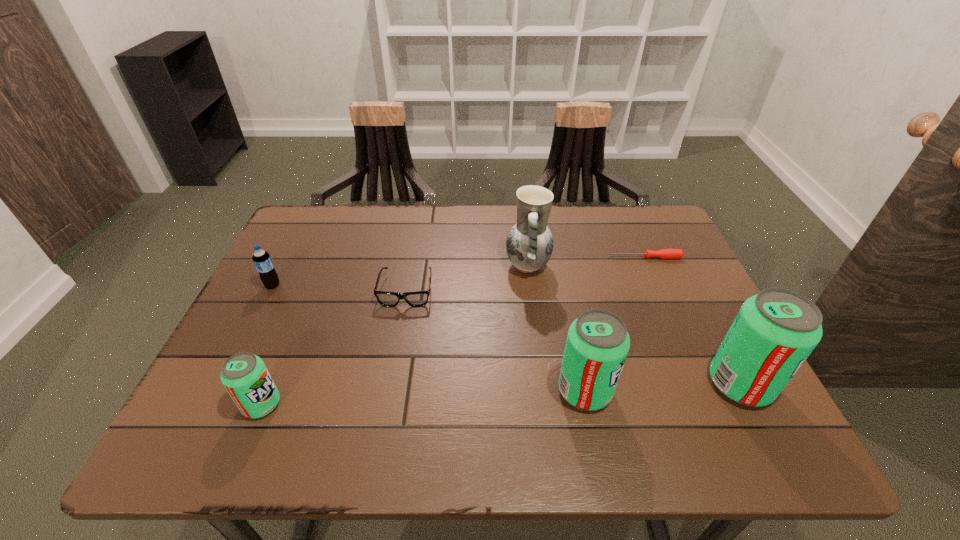
Where is `the second object from left to right`? This screenshot has height=540, width=960. the second object from left to right is located at coordinates (244, 375).

This screenshot has height=540, width=960. I want to click on the third tallest object, so pyautogui.click(x=597, y=344).

The height and width of the screenshot is (540, 960). What are the coordinates of `the third shortest soda bottle` in the screenshot? It's located at (597, 344).

Find the location of a particular element. The height and width of the screenshot is (540, 960). the rightmost soda bottle is located at coordinates (774, 332).

Find the location of `pottery`. pottery is located at coordinates (529, 245).

Where is `the shortest object`? The image size is (960, 540). the shortest object is located at coordinates (664, 253).

At what (x,y) coordinates should I click in order to perform the action: click on the leftmost object. Please return your answer as a coordinate pair (x, y). Looking at the image, I should click on (262, 260).

This screenshot has height=540, width=960. Identify the location of the farthest soda bottle. (262, 260).

Where is `the second shortest object`? The height and width of the screenshot is (540, 960). the second shortest object is located at coordinates (419, 298).

At what (x,y) coordinates should I click in order to perform the action: click on sunglasses. Please return your answer as a coordinate pair (x, y). This screenshot has width=960, height=540. Looking at the image, I should click on (419, 298).